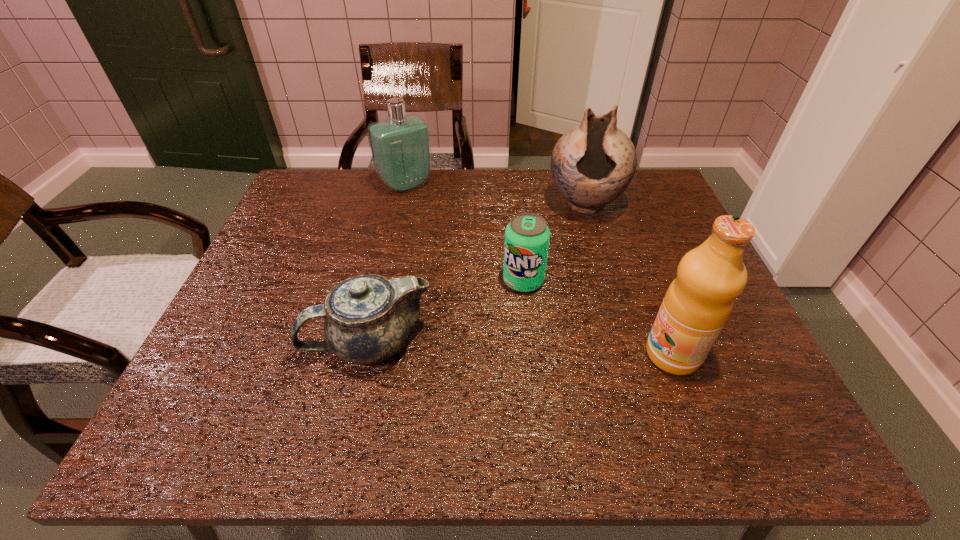
I want to click on free location located on the front label of the perfume, so click(x=433, y=214).

The width and height of the screenshot is (960, 540). I want to click on pottery at the far edge, so click(592, 164).

This screenshot has width=960, height=540. Find the location of `perfume that is at the far edge`. perfume that is at the far edge is located at coordinates click(401, 151).

You are a GUI agent. You are given a task and a screenshot of the screen. Output one action in this format:
    pyautogui.click(x=<x>, y=<y>)
    Task: Click on the chinaware positioned at the near edge
    Image resolution: width=960 pixels, height=540 pixels.
    Given the screenshot: What is the action you would take?
    pyautogui.click(x=367, y=318)

Identify the location of fruit juice present at the near edge. Image resolution: width=960 pixels, height=540 pixels. (699, 301).

Locate an element on the screen. fruit juice present at the right edge is located at coordinates (699, 301).

Where is `pottery situated at the right edge`? pottery situated at the right edge is located at coordinates (592, 164).

This screenshot has width=960, height=540. I want to click on object at the far right corner, so click(592, 164).

This screenshot has height=540, width=960. Find the location of `object at the near right corner`. object at the near right corner is located at coordinates (699, 301).

Locate an element on the screen. vacant space at the far edge of the desktop is located at coordinates (536, 193).